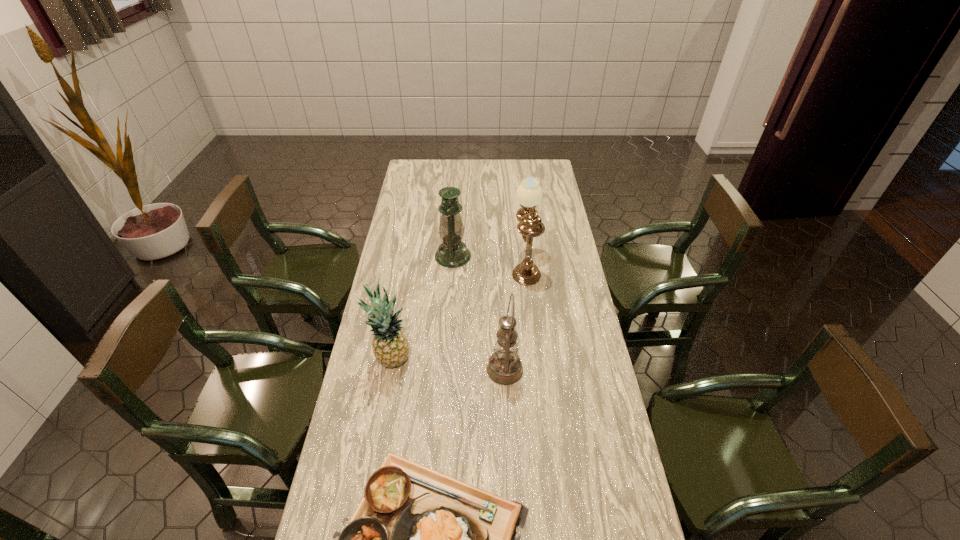
What are the coordinates of `vacant space at the right edge of the desktop` in the screenshot? It's located at (615, 523).

Find the location of `free space at the far right corner of the desktop`. free space at the far right corner of the desktop is located at coordinates (542, 164).

Where is `vacant region between the pineapple and the leftmost oil lamp`? The width and height of the screenshot is (960, 540). vacant region between the pineapple and the leftmost oil lamp is located at coordinates (422, 308).

This screenshot has height=540, width=960. I want to click on vacant region between the nearest oil lamp and the pineapple, so click(x=448, y=365).

At what (x,y) coordinates should I click in order to perform the action: click on object that is the fourth closest to the platter. Please return your answer as a coordinate pair (x, y). Image resolution: width=960 pixels, height=540 pixels. Looking at the image, I should click on (452, 253).

Identify which object is located as the third nearest to the pineapple. Please provide its 2D coordinates. Your answer should be formatted as a tuple, i.e. [(x, y)], where the tuple contains the x and y coordinates of a point satisfying the conditions above.

[(452, 253)]

I want to click on oil lamp that is the nearest to the nearest oil lamp, so click(529, 193).

Locate which oil lamp ranks in proximity to the shortest object. Please provide its 2D coordinates. Your answer should be formatted as a tuple, i.e. [(x, y)], where the tuple contains the x and y coordinates of a point satisfying the conditions above.

[(505, 367)]